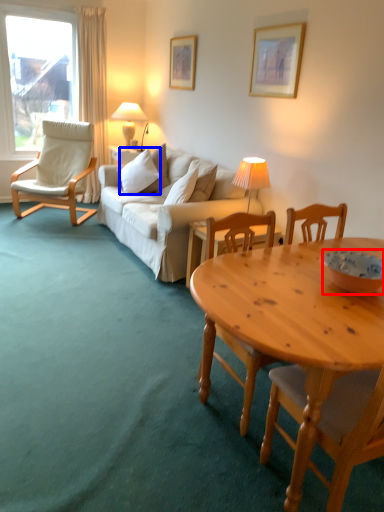
Question: Which point is closer to the camera, bowl (highlighted by a red box) or pillow (highlighted by a blue box)?

Choices:
 (A) bowl
 (B) pillow

Answer: (A)